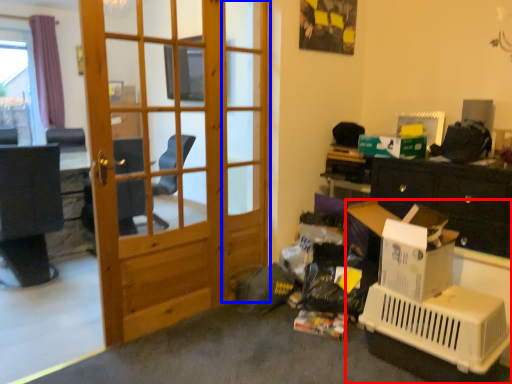
Question: Which of the following is the closest to the observer, desk (highlighted by a red box) or screen door (highlighted by a blue box)?

Choices:
 (A) desk
 (B) screen door

Answer: (A)